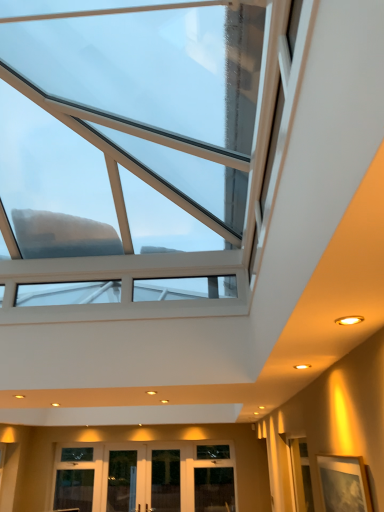
What is the approximate width of transparent glass door at center, the 3th glass door when ordered from left to right?

The width of transparent glass door at center, the 3th glass door when ordered from left to right, is 4.88 inches.

This screenshot has height=512, width=384. What do you see at coordinates (344, 484) in the screenshot? I see `wooden picture frame at lower right` at bounding box center [344, 484].

Consider the image. Measure the distance between transparent glass skylight at upper center and camera.

The depth of transparent glass skylight at upper center is 77.82 centimeters.

This screenshot has height=512, width=384. What are the coordinates of `clear glass door at center, the 2th glass door from the left` in the screenshot? It's located at (144, 480).

From a real-world perspective, relative to clear glass door at center, the 2th glass door from the left, is wooden picture frame at lower right vertically above or below?

wooden picture frame at lower right is above clear glass door at center, the 2th glass door from the left.

Image resolution: width=384 pixels, height=512 pixels. I want to click on picture frame lying in front of the clear glass door at center, the 2th glass door in the right-to-left sequence, so click(344, 484).

Considering their positions, is wooden picture frame at lower right located in front of or behind clear glass door at center, the 2th glass door in the right-to-left sequence?

wooden picture frame at lower right is positioned closer to the viewer than clear glass door at center, the 2th glass door in the right-to-left sequence.

Is wooden picture frame at lower right spatially inside clear glass door at center, the 2th glass door in the right-to-left sequence, or outside of it?

wooden picture frame at lower right is not inside clear glass door at center, the 2th glass door in the right-to-left sequence, it's outside.

From the picture: In terms of height, does transparent glass door at center, the 1th glass door positioned from the right, look taller or shorter compared to transparent glass door at lower center, placed as the first glass door when sorted from left to right?

Clearly, transparent glass door at center, the 1th glass door positioned from the right, is taller compared to transparent glass door at lower center, placed as the first glass door when sorted from left to right.

Is point (166, 457) more distant than point (124, 464)?

That is True.

From the image's perspective, is wooden picture frame at lower right on transparent glass door at center, the 1th glass door positioned from the right?

Correct, wooden picture frame at lower right appears higher than transparent glass door at center, the 1th glass door positioned from the right, in the image.

Find the location of a particular element. Image resolution: width=384 pixels, height=512 pixels. the 1st glass door behind the wooden picture frame at lower right, starting your count from the anchor is located at coordinates [165, 480].

Does wooden picture frame at lower right have a smaller size compared to transparent glass door at center, the 3th glass door when ordered from left to right?

Yes, wooden picture frame at lower right is smaller than transparent glass door at center, the 3th glass door when ordered from left to right.

Is transparent glass skylight at upper center outside of transparent glass door at lower center, placed as the first glass door when sorted from left to right?

transparent glass skylight at upper center is positioned outside transparent glass door at lower center, placed as the first glass door when sorted from left to right.

From a real-world perspective, is transparent glass skylight at upper center located higher than transparent glass door at lower center, placed as the first glass door when sorted from left to right?

Correct, in the physical world, transparent glass skylight at upper center is higher than transparent glass door at lower center, placed as the first glass door when sorted from left to right.

From the image's perspective, would you say transparent glass skylight at upper center is shown under transparent glass door at lower center, the 3th glass door positioned from the right?

No.

From their relative heights in the image, would you say transparent glass skylight at upper center is taller or shorter than transparent glass door at lower center, the 3th glass door positioned from the right?

Clearly, transparent glass skylight at upper center is shorter compared to transparent glass door at lower center, the 3th glass door positioned from the right.

Which object is closer to the camera taking this photo, transparent glass skylight at upper center or transparent glass door at center, the 3th glass door when ordered from left to right?

transparent glass skylight at upper center is in front.

From the image's perspective, is transparent glass skylight at upper center above or below transparent glass door at center, the 1th glass door positioned from the right?

Clearly, from the image's perspective, transparent glass skylight at upper center is above transparent glass door at center, the 1th glass door positioned from the right.

Considering the relative positions of transparent glass skylight at upper center and transparent glass door at center, the 1th glass door positioned from the right, in the image provided, is transparent glass skylight at upper center to the left of transparent glass door at center, the 1th glass door positioned from the right, from the viewer's perspective?

Yes.

Is transparent glass skylight at upper center oriented away from transparent glass door at center, the 1th glass door positioned from the right?

transparent glass skylight at upper center does not have its back to transparent glass door at center, the 1th glass door positioned from the right.

Is transparent glass door at center, the 3th glass door when ordered from left to right, located outside wooden picture frame at lower right?

Yes, transparent glass door at center, the 3th glass door when ordered from left to right, is located beyond the bounds of wooden picture frame at lower right.

Could you measure the distance between transparent glass door at center, the 3th glass door when ordered from left to right, and wooden picture frame at lower right?

transparent glass door at center, the 3th glass door when ordered from left to right, and wooden picture frame at lower right are 5.13 meters apart.

Does transparent glass door at center, the 1th glass door positioned from the right, turn towards wooden picture frame at lower right?

Yes, transparent glass door at center, the 1th glass door positioned from the right, is turned towards wooden picture frame at lower right.

Which of these two, clear glass door at center, the 2th glass door in the right-to-left sequence, or transparent glass door at center, the 1th glass door positioned from the right, is wider?

transparent glass door at center, the 1th glass door positioned from the right, is wider.

Looking at the image, does clear glass door at center, the 2th glass door in the right-to-left sequence, seem bigger or smaller compared to transparent glass door at center, the 1th glass door positioned from the right?

Clearly, clear glass door at center, the 2th glass door in the right-to-left sequence, is larger in size than transparent glass door at center, the 1th glass door positioned from the right.

Are clear glass door at center, the 2th glass door from the left, and transparent glass door at center, the 3th glass door when ordered from left to right, located far from each other?

clear glass door at center, the 2th glass door from the left, is actually quite close to transparent glass door at center, the 3th glass door when ordered from left to right.

Consider the image. Can you confirm if clear glass door at center, the 2th glass door in the right-to-left sequence, is taller than transparent glass door at center, the 3th glass door when ordered from left to right?

Yes.

There is a wooden picture frame at lower right. At what (x,y) coordinates should I click in order to perform the action: click on the 2nd glass door below it (from the image's perspective). Please return your answer as a coordinate pair (x, y). Looking at the image, I should click on (144, 480).

The image size is (384, 512). What are the coordinates of `glass door that is the 2nd object to the left of the transparent glass door at center, the 1th glass door positioned from the right, starting at the anchor` in the screenshot? It's located at (122, 481).

Considering their positions, is transparent glass door at center, the 1th glass door positioned from the right, positioned further to wooden picture frame at lower right than transparent glass skylight at upper center?

Based on the image, transparent glass door at center, the 1th glass door positioned from the right, appears to be further to wooden picture frame at lower right.

From the image, which object appears to be farther from wooden picture frame at lower right, transparent glass door at lower center, the 3th glass door positioned from the right, or transparent glass skylight at upper center?

Based on the image, transparent glass door at lower center, the 3th glass door positioned from the right, appears to be further to wooden picture frame at lower right.

When comparing their distances from transparent glass door at lower center, the 3th glass door positioned from the right, does transparent glass door at center, the 1th glass door positioned from the right, or transparent glass skylight at upper center seem closer?

Based on the image, transparent glass door at center, the 1th glass door positioned from the right, appears to be nearer to transparent glass door at lower center, the 3th glass door positioned from the right.

Based on their spatial positions, is transparent glass door at center, the 3th glass door when ordered from left to right, or transparent glass door at lower center, placed as the first glass door when sorted from left to right, further from clear glass door at center, the 2th glass door from the left?

Based on the image, transparent glass door at center, the 3th glass door when ordered from left to right, appears to be further to clear glass door at center, the 2th glass door from the left.

Based on their spatial positions, is transparent glass skylight at upper center or transparent glass door at center, the 3th glass door when ordered from left to right, further from clear glass door at center, the 2th glass door from the left?

The object further to clear glass door at center, the 2th glass door from the left, is transparent glass skylight at upper center.

From the image, which object appears to be nearer to clear glass door at center, the 2th glass door from the left, wooden picture frame at lower right or transparent glass skylight at upper center?

transparent glass skylight at upper center is closer to clear glass door at center, the 2th glass door from the left.

Estimate the real-world distances between objects in this image. Which object is further from transparent glass skylight at upper center, wooden picture frame at lower right or transparent glass door at center, the 1th glass door positioned from the right?

Among the two, transparent glass door at center, the 1th glass door positioned from the right, is located further to transparent glass skylight at upper center.

Estimate the real-world distances between objects in this image. Which object is further from wooden picture frame at lower right, transparent glass door at lower center, the 3th glass door positioned from the right, or transparent glass door at center, the 1th glass door positioned from the right?

transparent glass door at lower center, the 3th glass door positioned from the right, is further to wooden picture frame at lower right.

Locate an element on the screen. glass door between transparent glass door at lower center, the 3th glass door positioned from the right, and transparent glass door at center, the 1th glass door positioned from the right is located at coordinates (144, 480).

Where is `glass door between transparent glass skylight at upper center and clear glass door at center, the 2th glass door from the left, in the front-back direction`? The image size is (384, 512). glass door between transparent glass skylight at upper center and clear glass door at center, the 2th glass door from the left, in the front-back direction is located at coordinates (165, 480).

You are a GUI agent. You are given a task and a screenshot of the screen. Output one action in this format:
    pyautogui.click(x=<x>, y=<y>)
    Task: Click on the picture frame positioned between transparent glass skylight at upper center and clear glass door at center, the 2th glass door from the left, from near to far
    The width and height of the screenshot is (384, 512).
    Given the screenshot: What is the action you would take?
    pyautogui.click(x=344, y=484)

You are a GUI agent. You are given a task and a screenshot of the screen. Output one action in this format:
    pyautogui.click(x=<x>, y=<y>)
    Task: Click on the picture frame between transparent glass skylight at upper center and transparent glass door at center, the 1th glass door positioned from the right, in the front-back direction
    This screenshot has height=512, width=384.
    Given the screenshot: What is the action you would take?
    pyautogui.click(x=344, y=484)